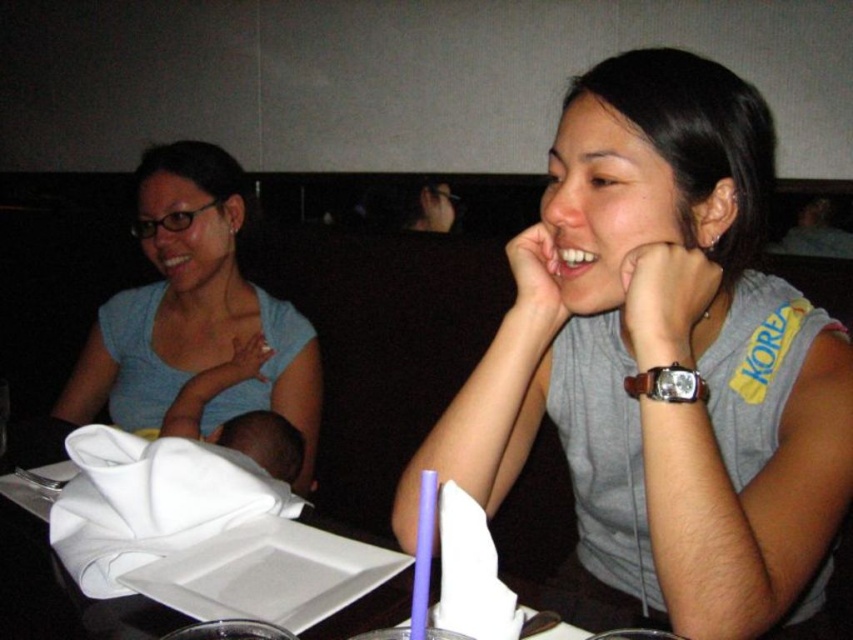
Question: Is gray fabric shirt at center positioned before matte blue shirt at left?

Choices:
 (A) no
 (B) yes

Answer: (B)

Question: Can you confirm if gray fabric shirt at center is positioned to the right of white paper napkin at center?

Choices:
 (A) yes
 (B) no

Answer: (A)

Question: Which of the following is the closest to the observer?

Choices:
 (A) (177, 368)
 (B) (770, 301)
 (C) (584, 637)

Answer: (C)

Question: Estimate the real-world distances between objects in this image. Which object is closer to the gray fabric shirt at center?

Choices:
 (A) white paper napkin at center
 (B) matte blue shirt at left

Answer: (A)

Question: Can you confirm if matte blue shirt at left is bigger than white paper napkin at center?

Choices:
 (A) no
 (B) yes

Answer: (B)

Question: Estimate the real-world distances between objects in this image. Which object is farther from the white paper napkin at center?

Choices:
 (A) matte blue shirt at left
 (B) gray fabric shirt at center

Answer: (B)